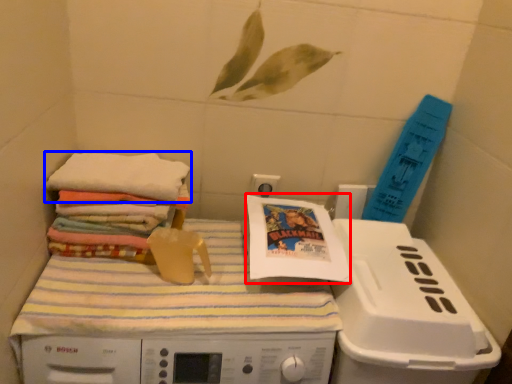
Question: Which point is further to the camera, comic book (highlighted by a red box) or towel (highlighted by a blue box)?

Choices:
 (A) comic book
 (B) towel

Answer: (A)